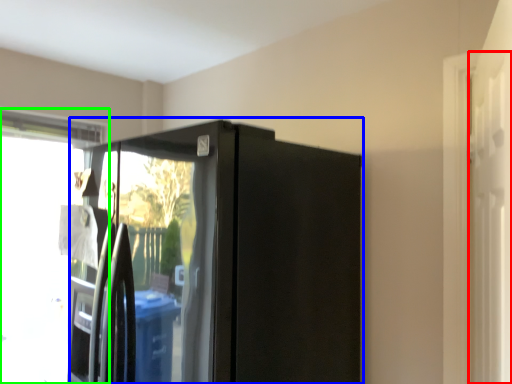
Question: Based on their relative distances, which object is farther from screen door (highlighted by a red box)? Choose from appliance (highlighted by a blue box) and window (highlighted by a green box).

Choices:
 (A) appliance
 (B) window

Answer: (B)